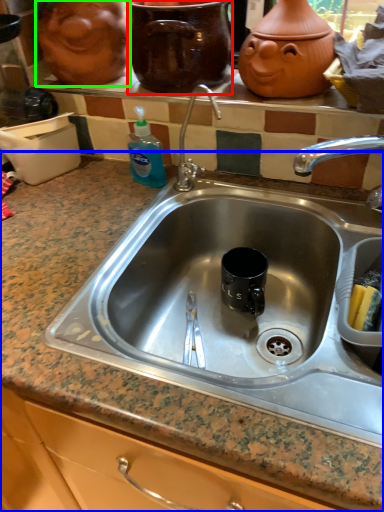
Question: Estimate the real-world distances between objects in this image. Which object is closer to pottery (highlighted by a red box), countertop (highlighted by a blue box) or face (highlighted by a green box)?

Choices:
 (A) countertop
 (B) face

Answer: (B)